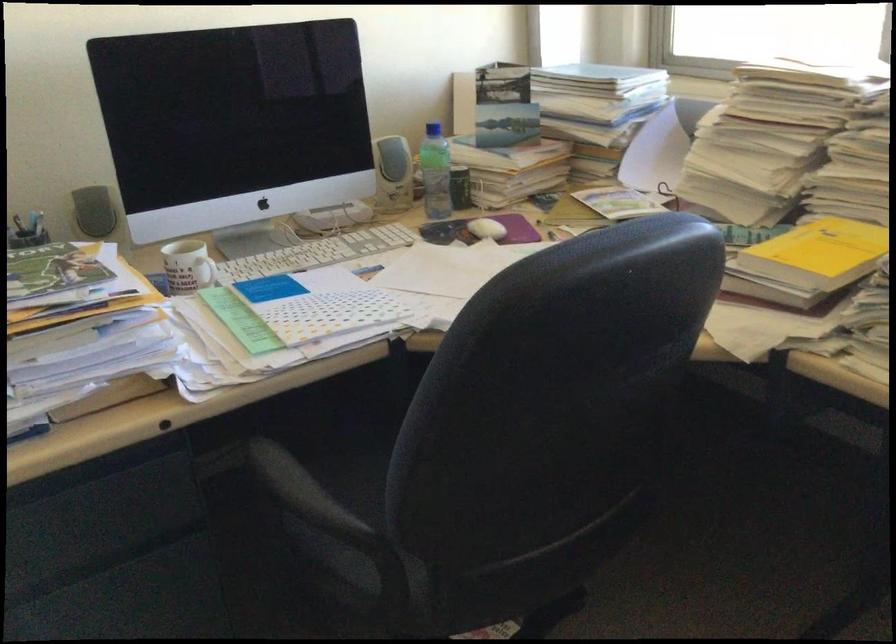
Image resolution: width=896 pixels, height=644 pixels. Describe the element at coordinates (487, 229) in the screenshot. I see `a white computer mouse` at that location.